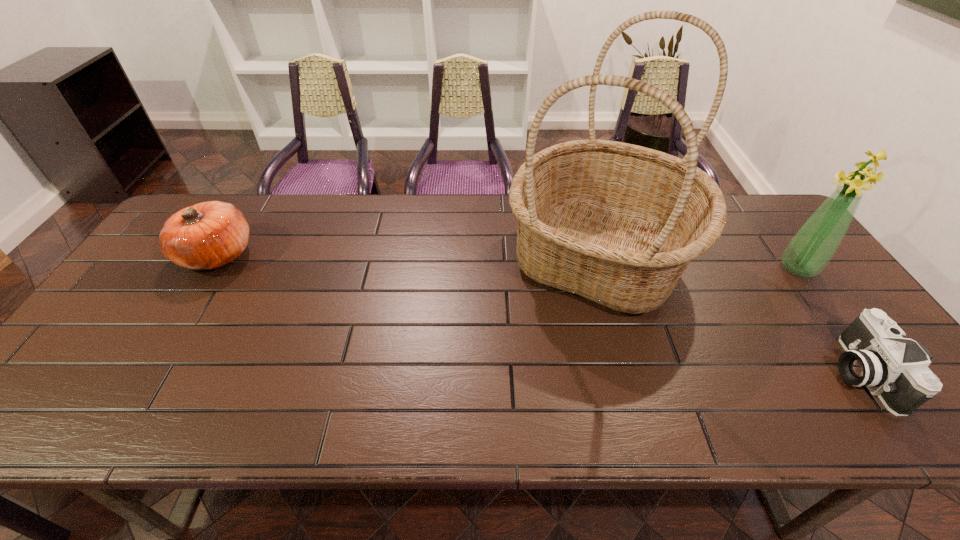
The height and width of the screenshot is (540, 960). Identify the location of free space located 0.340m on the front-facing side of the bouquet. (660, 268).

The height and width of the screenshot is (540, 960). Identify the location of free space located on the right of the pumpkin. (276, 255).

Locate an element on the screen. The image size is (960, 540). vacant area situated 0.290m on the back of the shortest object is located at coordinates (778, 255).

Where is `basket located in the far edge section of the desktop`? This screenshot has width=960, height=540. basket located in the far edge section of the desktop is located at coordinates (616, 223).

This screenshot has height=540, width=960. I want to click on pumpkin situated at the far edge, so click(205, 236).

Locate an element on the screen. object that is at the near edge is located at coordinates (876, 356).

At what (x,y) coordinates should I click in order to perform the action: click on object located in the left edge section of the desktop. Please return your answer as a coordinate pair (x, y). This screenshot has height=540, width=960. Looking at the image, I should click on (205, 236).

Image resolution: width=960 pixels, height=540 pixels. I want to click on bouquet present at the right edge, so click(810, 250).

In order to click on camera at the right edge in this screenshot , I will do `click(876, 356)`.

Where is `object at the far left corner`? This screenshot has height=540, width=960. object at the far left corner is located at coordinates (205, 236).